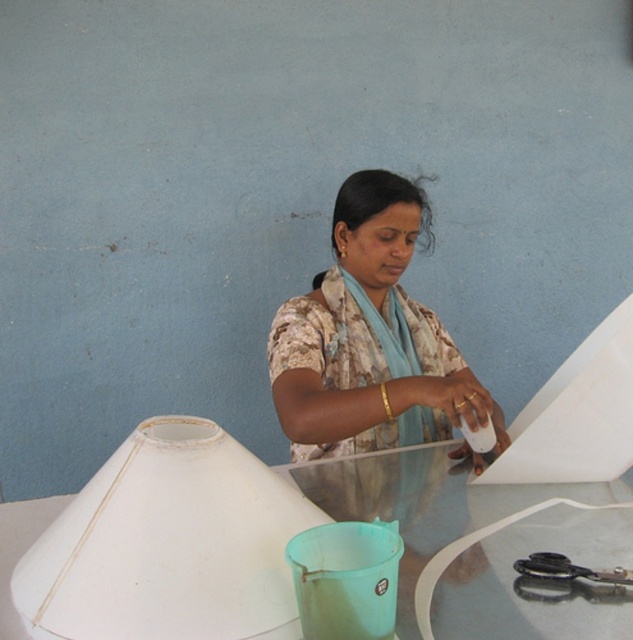
You are trying to place the black plastic scissors at lower right on the transparent glass table at center. Will the scissors fit on the table?

The transparent glass table at center is wider than the black plastic scissors at lower right, so the scissors will fit on the table.

Consider the image. You are standing in the room and want to place a new decorative item on the transparent glass table at center. According to the coordinates given, where exactly should you place it?

The transparent glass table at center is located at coordinates point [536,582], so you should place the decorative item there.

You are an interior designer who needs to place a new decorative item on the table. The table has a matte floral shirt at center. Where exactly should you place the new item to avoid overlapping with the existing one?

The matte floral shirt at center is located at coordinates point (370, 339), so you should place the new item somewhere else on the table, not at that exact point.